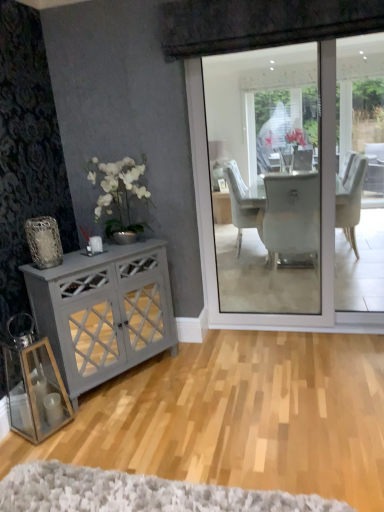
At what (x,y) coordinates should I click in order to perform the action: click on matte gray cabinet at left. Please return your answer as a coordinate pair (x, y). The image size is (384, 512). Looking at the image, I should click on (104, 311).

The width and height of the screenshot is (384, 512). What do you see at coordinates (104, 311) in the screenshot?
I see `matte gray cabinet at left` at bounding box center [104, 311].

What is the approximate width of matte gray cabinet at left?

38.31 centimeters.

Locate an element on the screen. matte gray cabinet at left is located at coordinates (104, 311).